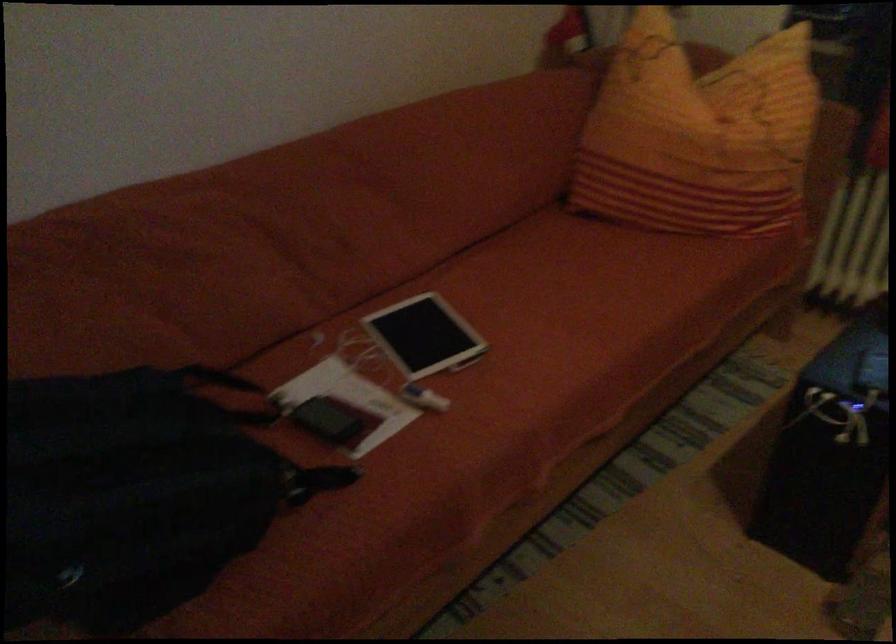
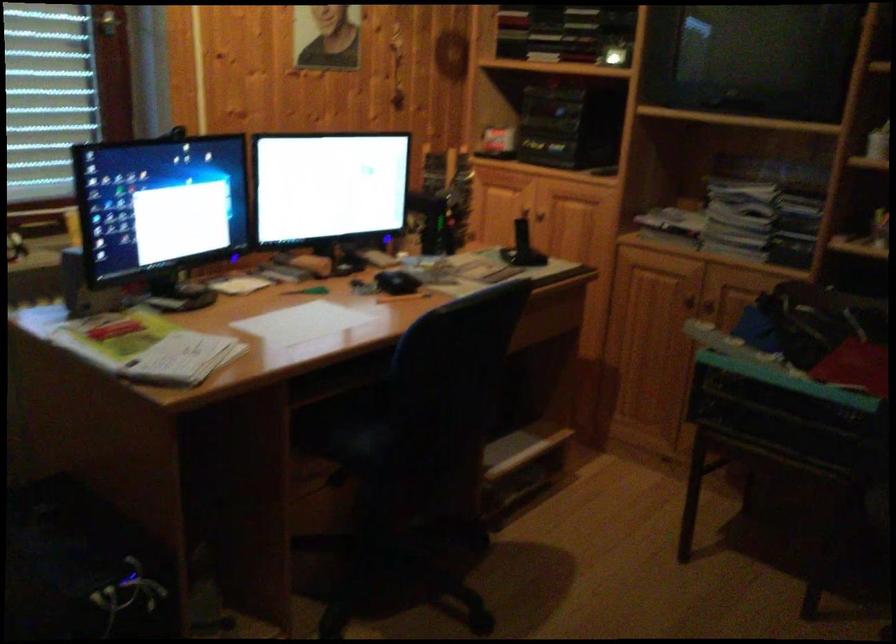
Based on the photo, based on the continuous images, in which direction is the camera rotating?

The camera rotated toward right-down.